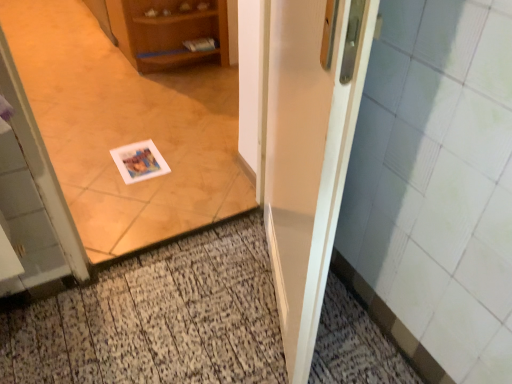
You are a GUI agent. You are given a task and a screenshot of the screen. Output one action in this format:
    pyautogui.click(x=<x>, y=<y>)
    Task: Click on the free location to the left of white glossy door at center
    The width and height of the screenshot is (512, 384).
    Given the screenshot: What is the action you would take?
    pyautogui.click(x=192, y=311)